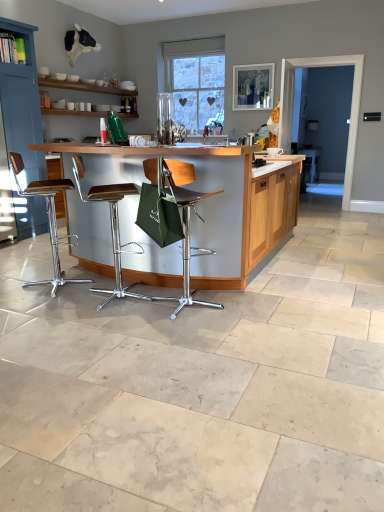
At what (x,y) coordinates should I click in order to perform the action: click on free location to the left of green fabric chair at center, the first chair positioned from the right. Please return your answer as a coordinate pair (x, y). Looking at the image, I should click on (122, 317).